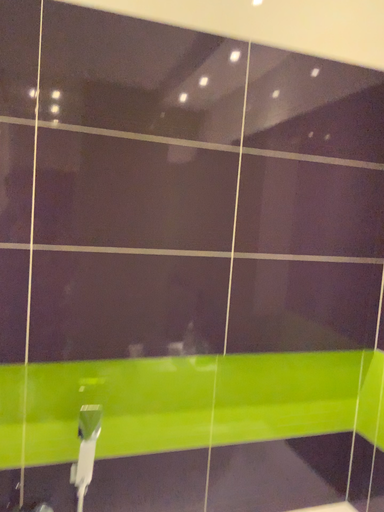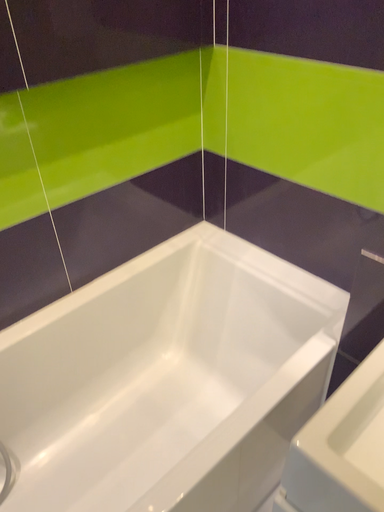
Question: Which way did the camera rotate in the video?

Choices:
 (A) rotated left
 (B) rotated right

Answer: (B)